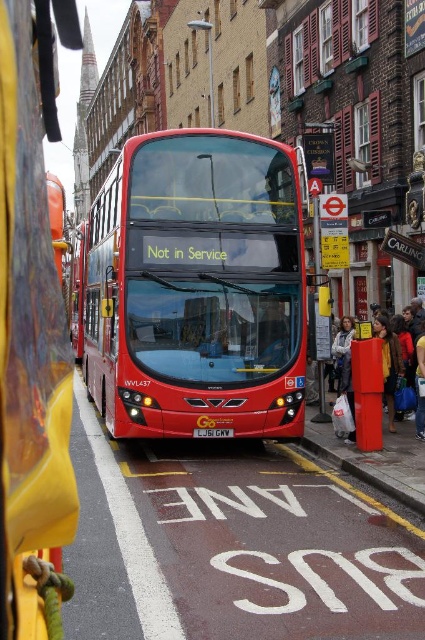
Question: Does red plastic box at right have a lesser width compared to yellow metallic license plate at center?

Choices:
 (A) yes
 (B) no

Answer: (B)

Question: Which point is closer to the camera?

Choices:
 (A) (215, 252)
 (B) (221, 429)

Answer: (A)

Question: Which point is closer to the camera?

Choices:
 (A) yellow metallic license plate at center
 (B) red plastic box at right

Answer: (A)

Question: Is red plastic box at right to the right of yellow metallic license plate at center from the viewer's perspective?

Choices:
 (A) yes
 (B) no

Answer: (A)

Question: Is shiny red bus at center bigger than yellow metallic license plate at center?

Choices:
 (A) yes
 (B) no

Answer: (A)

Question: Among these points, which one is farthest from the camera?

Choices:
 (A) (201, 433)
 (B) (393, 378)

Answer: (B)